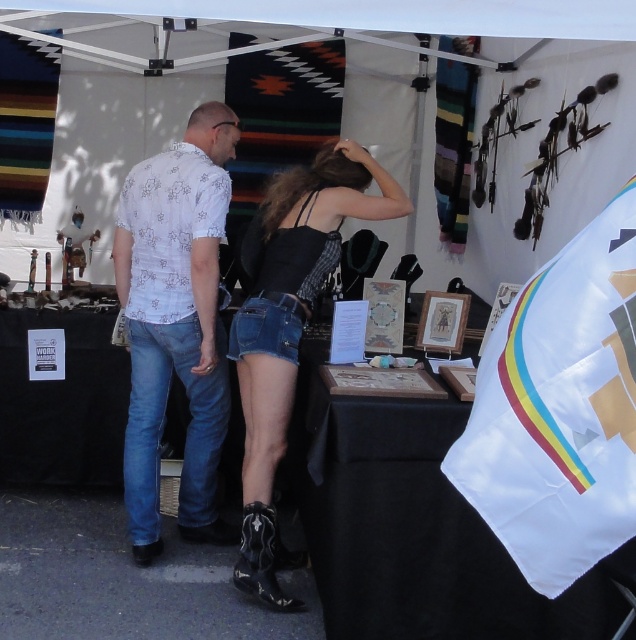
Does black fabric table at center have a smaller size compared to denim shorts at center?

Incorrect, black fabric table at center is not smaller in size than denim shorts at center.

Is point (357, 630) less distant than point (228, 344)?

Yes, point (357, 630) is in front of point (228, 344).

I want to click on black fabric table at center, so click(415, 529).

Does white floral shirt at center have a smaller size compared to denim shorts at center?

Yes, white floral shirt at center is smaller than denim shorts at center.

Does point (118, 236) lie behind point (286, 371)?

Yes.

Identify the location of white floral shirt at center. (176, 323).

Can you confirm if black fabric table at center is shorter than white floral shirt at center?

Correct, black fabric table at center is not as tall as white floral shirt at center.

Does black fabric table at center come in front of white floral shirt at center?

Yes, it is in front of white floral shirt at center.

Is point (574, 625) in front of point (214, 454)?

Yes, it is.

Locate an element on the screen. The width and height of the screenshot is (636, 640). black fabric table at center is located at coordinates (415, 529).